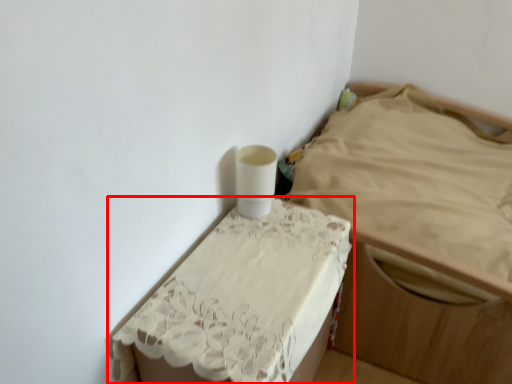
Question: From the image's perspective, considering the relative positions of furniture (annotated by the red box) and furniture in the image provided, where is furniture (annotated by the red box) located with respect to the staircase?

Choices:
 (A) above
 (B) below

Answer: (B)